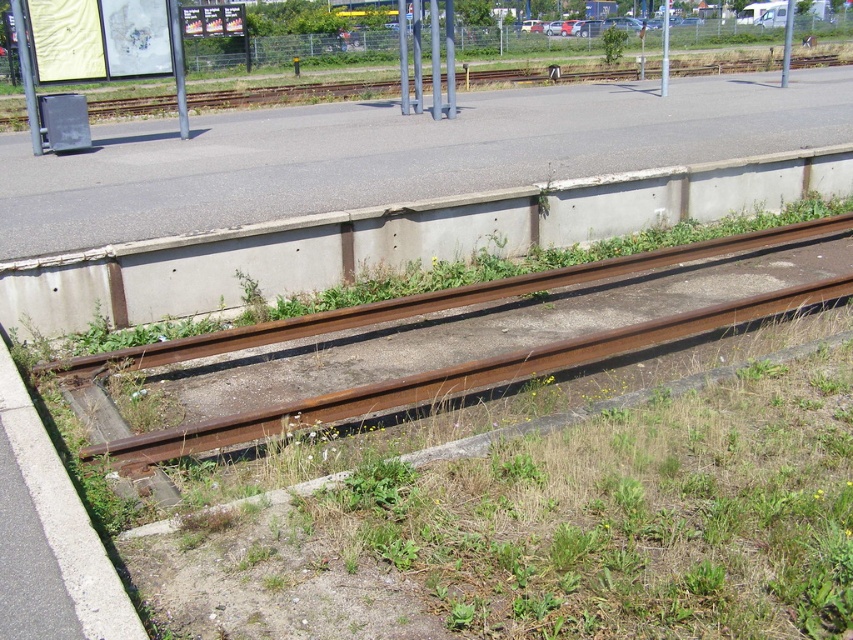
Question: Estimate the real-world distances between objects in this image. Which object is closer to the metallic gray trash can at left?

Choices:
 (A) concrete at lower left
 (B) concrete at center
 (C) green grass at bottom

Answer: (B)

Question: Does rusty metal train track at lower center appear over metallic gray trash can at left?

Choices:
 (A) no
 (B) yes

Answer: (A)

Question: Which object is the farthest from the concrete at lower left?

Choices:
 (A) green leafy plant at center
 (B) concrete at center

Answer: (A)

Question: Does concrete at center lie behind green leafy plant at center?

Choices:
 (A) yes
 (B) no

Answer: (B)

Question: Can you confirm if green grass at bottom is positioned to the right of concrete at lower left?

Choices:
 (A) no
 (B) yes

Answer: (B)

Question: Among these objects, which one is farthest from the camera?

Choices:
 (A) green grass at bottom
 (B) green leafy plant at center
 (C) concrete at lower left
 (D) concrete at center

Answer: (B)